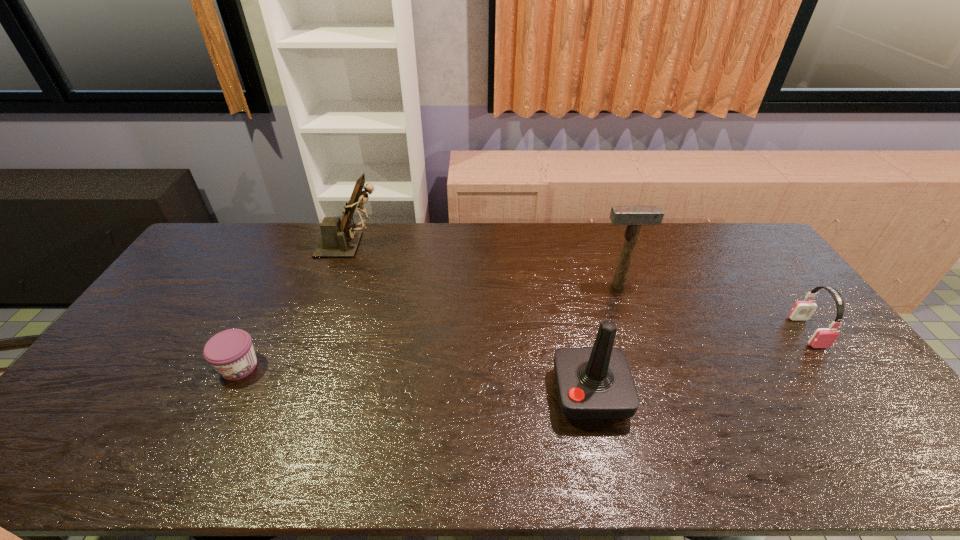
Locate which object is the fourth closest to the third farthest object. Please provide its 2D coordinates. Your answer should be formatted as a tuple, i.e. [(x, y)], where the tuple contains the x and y coordinates of a point satisfying the conditions above.

[(231, 353)]

Image resolution: width=960 pixels, height=540 pixels. What are the coordinates of `free region that satisfies the following two spatial constraints: 1. on the back side of the second object from right to left; 2. on the left side of the joystick` in the screenshot? It's located at (566, 285).

Find the location of a particular element. vacant area that satisfies the following two spatial constraints: 1. on the front label of the leftmost object; 2. on the right side of the joystick is located at coordinates (226, 394).

At what (x,y) coordinates should I click in order to perform the action: click on free space that satisfies the following two spatial constraints: 1. on the back side of the second farthest object; 2. on the front-facing side of the fourth object from right to left. Please return your answer as a coordinate pair (x, y). This screenshot has height=540, width=960. Looking at the image, I should click on (604, 245).

The image size is (960, 540). I want to click on free location that satisfies the following two spatial constraints: 1. on the front-facing side of the farthest object; 2. on the right side of the third object from left to right, so click(297, 394).

Where is `vacant point that satisfies the following two spatial constraints: 1. on the front-facing side of the figurine; 2. on the front label of the jam`? The image size is (960, 540). vacant point that satisfies the following two spatial constraints: 1. on the front-facing side of the figurine; 2. on the front label of the jam is located at coordinates pos(306,367).

Identify the location of vacant area in the image that satisfies the following two spatial constraints: 1. on the front-facing side of the joystick; 2. on the right side of the farthest object. This screenshot has height=540, width=960. (297, 394).